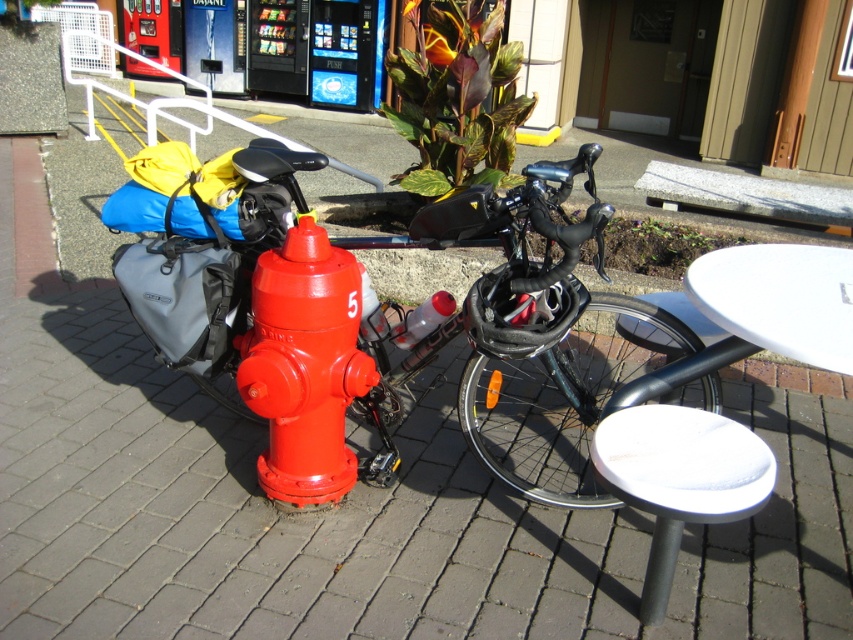
Is shiny black bicycle at center closer to the viewer compared to glossy red fire hydrant at center?

Yes, shiny black bicycle at center is closer to the viewer.

Is shiny black bicycle at center to the left of glossy red fire hydrant at center from the viewer's perspective?

No, shiny black bicycle at center is not to the left of glossy red fire hydrant at center.

Which is in front, point (519, 461) or point (263, 472)?

Point (263, 472)

Image resolution: width=853 pixels, height=640 pixels. I want to click on shiny black bicycle at center, so click(408, 339).

Is shiny black bicycle at center taller than white plastic table at lower right?

Correct, shiny black bicycle at center is much taller as white plastic table at lower right.

Is shiny black bicycle at center smaller than white plastic table at lower right?

No.

The height and width of the screenshot is (640, 853). In order to click on shiny black bicycle at center in this screenshot , I will do `click(408, 339)`.

Between white plastic table at lower right and white plastic rail at upper left, which one is positioned higher?

white plastic rail at upper left is above.

Does point (842, 266) come closer to viewer compared to point (209, 108)?

Yes, it is.

Is point (767, 308) positioned in front of point (112, 92)?

Yes, it is.

Identify the location of white plastic table at lower right. Image resolution: width=853 pixels, height=640 pixels. (780, 298).